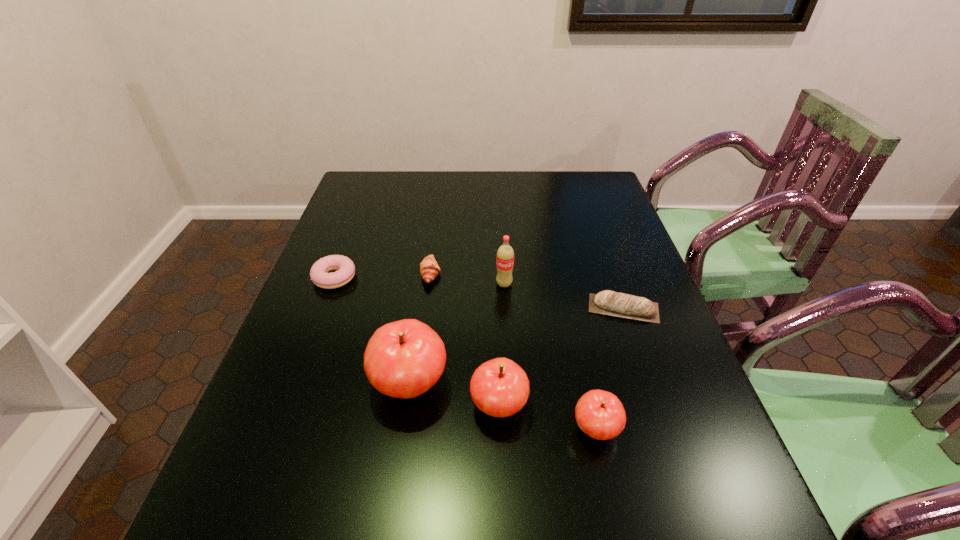
The width and height of the screenshot is (960, 540). In order to click on free space for a new apple on the right in this screenshot , I will do `click(702, 455)`.